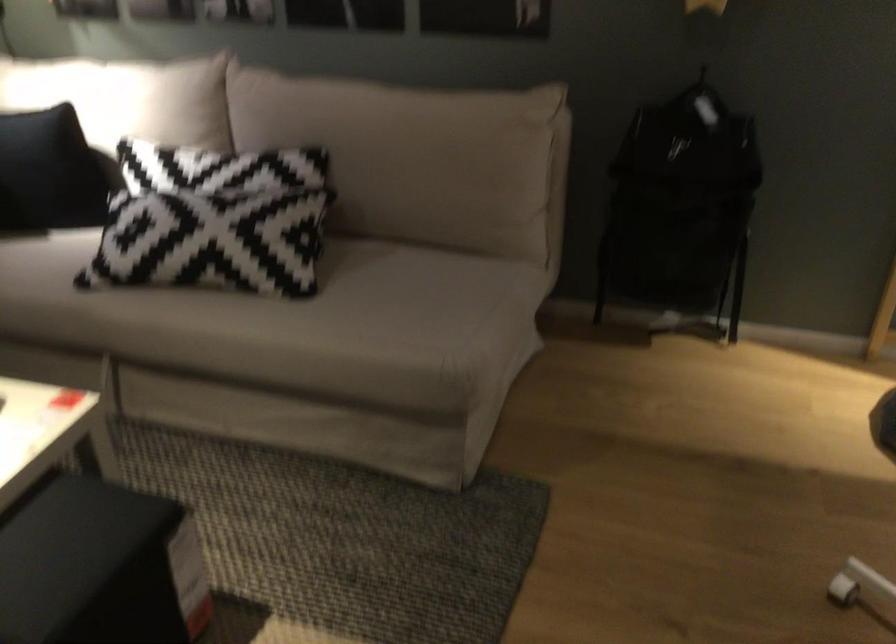
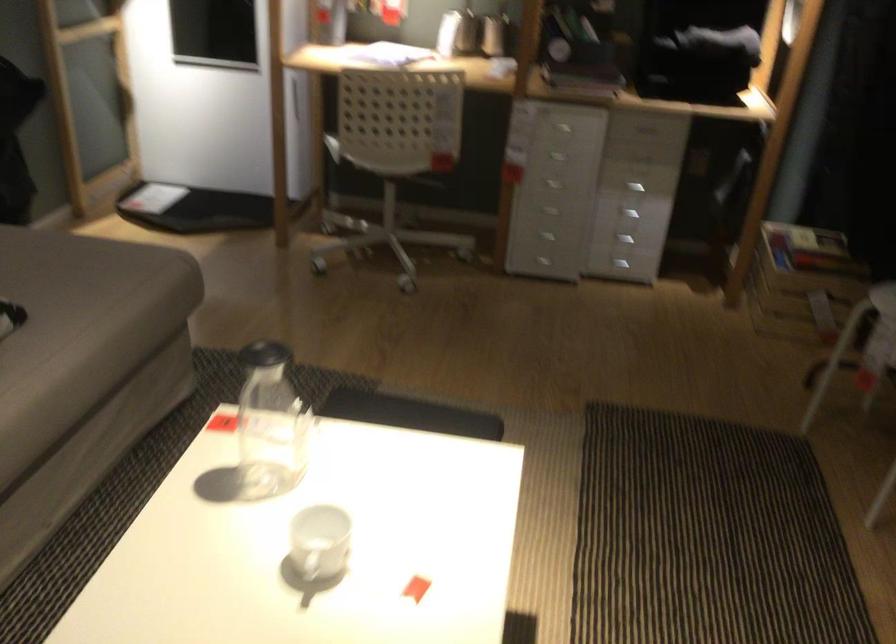
Find the pixel in the second image that matches the point at 320,328 in the first image.

(82, 324)